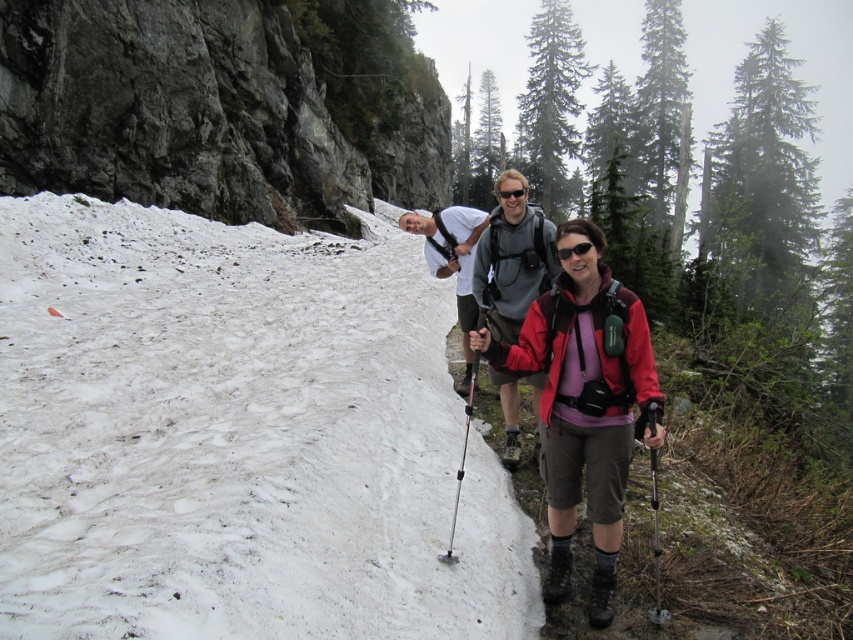
Question: Which point is farther from the camera taking this photo?

Choices:
 (A) (503, 195)
 (B) (485, 225)
 (C) (569, 332)
 (D) (256, 465)

Answer: (B)

Question: Among these points, which one is nearest to the camera?

Choices:
 (A) (656, 596)
 (B) (434, 237)
 (C) (206, 381)

Answer: (A)

Question: Can you confirm if gray fleece jacket at center is positioned to the left of white matte t-shirt at center?

Choices:
 (A) yes
 (B) no

Answer: (B)

Question: Can you confirm if gray fleece jacket at center is thinner than white matte t-shirt at center?

Choices:
 (A) no
 (B) yes

Answer: (B)

Question: Can you confirm if black rubber ski pole at center is wider than silver metallic ski pole at center?

Choices:
 (A) no
 (B) yes

Answer: (B)

Question: Among these points, which one is nearest to the camera?

Choices:
 (A) (468, 289)
 (B) (279, 83)
 (C) (466, 442)
 (D) (566, 461)

Answer: (D)